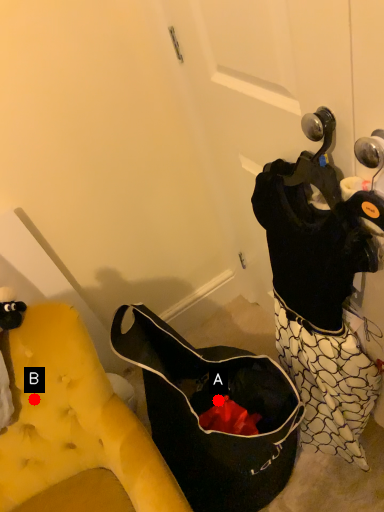
Question: Two points are circled on the image, labeled by A and B beside each circle. Which of the following is the farthest from the observer?

Choices:
 (A) A is further
 (B) B is further

Answer: (A)